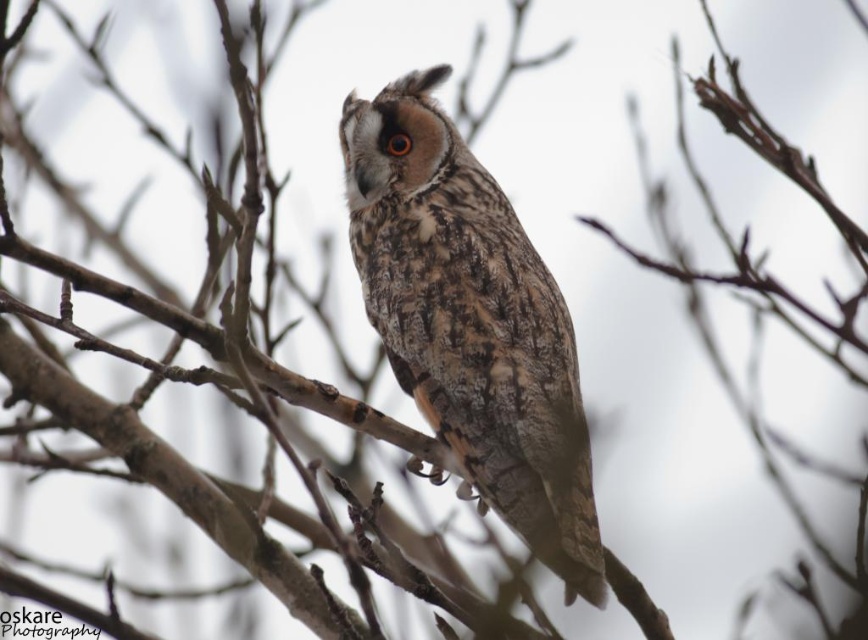
What are the coordinates of the camouflage feathered owl at center?

The camouflage feathered owl at center is located at point (472, 323).

You are an ornithologist observing the owl in the image. You notice the camouflage feathered owl at center and the brown textured eye at center. Which object is positioned closer to you?

The camouflage feathered owl at center is closer to the viewer than the brown textured eye at center.